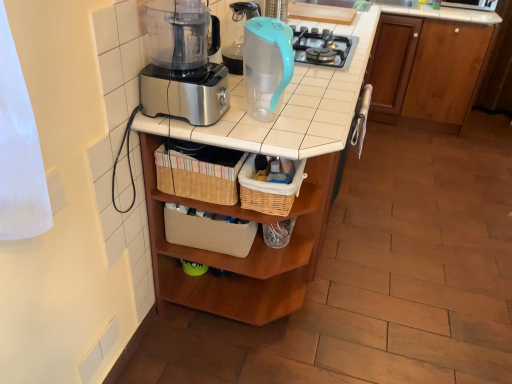
Locate an element on the screen. This screenshot has height=384, width=512. woven wicker basket at center, arranged as the first basket when viewed from the right is located at coordinates (269, 190).

In the scene shown: Which is in front, brown wood cabinet at upper right or wooden table at center?

wooden table at center is more forward.

How many degrees apart are the facing directions of brown wood cabinet at upper right and wooden table at center?

There is a 91-degree angle between the facing directions of brown wood cabinet at upper right and wooden table at center.

Between brown wood cabinet at upper right and wooden table at center, which one appears on the right side from the viewer's perspective?

brown wood cabinet at upper right.

How much distance is there between brown wood cabinet at upper right and woven straw basket at center, arranged as the second basket when viewed from the right?

brown wood cabinet at upper right and woven straw basket at center, arranged as the second basket when viewed from the right, are 2.28 meters apart from each other.

From the image's perspective, which object appears higher, brown wood cabinet at upper right or woven straw basket at center, arranged as the second basket when viewed from the right?

brown wood cabinet at upper right is shown above in the image.

Image resolution: width=512 pixels, height=384 pixels. I want to click on the 1st basket below the brown wood cabinet at upper right (from the image's perspective), so click(x=199, y=171).

Does brown wood cabinet at upper right touch woven straw basket at center, arranged as the second basket when viewed from the right?

No, brown wood cabinet at upper right is not touching woven straw basket at center, arranged as the second basket when viewed from the right.

Does teal plastic pitcher at upper center have a larger size compared to brown wood cabinet at upper right?

Incorrect, teal plastic pitcher at upper center is not larger than brown wood cabinet at upper right.

From a real-world perspective, is teal plastic pitcher at upper center on brown wood cabinet at upper right?

Yes, from a real-world perspective, teal plastic pitcher at upper center is above brown wood cabinet at upper right.

Can you confirm if teal plastic pitcher at upper center is thinner than brown wood cabinet at upper right?

Yes, teal plastic pitcher at upper center is thinner than brown wood cabinet at upper right.

Which of these two, teal plastic pitcher at upper center or brown wood cabinet at upper right, stands taller?

Standing taller between the two is brown wood cabinet at upper right.

Is point (249, 193) closer or farther from the camera than point (286, 78)?

Point (249, 193) appears to be farther away from the viewer than point (286, 78).

Is woven wicker basket at center, arranged as the first basket when viewed from the right, looking in the opposite direction of teal plastic pitcher at upper center?

No, teal plastic pitcher at upper center is not at the back of woven wicker basket at center, arranged as the first basket when viewed from the right.

Where is `the 2nd basket below when counting from the teal plastic pitcher at upper center (from the image's perspective)`? the 2nd basket below when counting from the teal plastic pitcher at upper center (from the image's perspective) is located at coordinates (269, 190).

How many degrees apart are the facing directions of woven wicker basket at center, which appears as the second basket when viewed from the left, and teal plastic pitcher at upper center?

There is a 0.00133-degree angle between the facing directions of woven wicker basket at center, which appears as the second basket when viewed from the left, and teal plastic pitcher at upper center.

What's the angular difference between brown wood cabinet at upper right and woven wicker basket at center, which appears as the second basket when viewed from the left,'s facing directions?

The angular difference between brown wood cabinet at upper right and woven wicker basket at center, which appears as the second basket when viewed from the left, is 91 degrees.

Does brown wood cabinet at upper right have a greater height compared to woven wicker basket at center, which appears as the second basket when viewed from the left?

Yes.

Where is `the 2nd basket in front of the brown wood cabinet at upper right`? The image size is (512, 384). the 2nd basket in front of the brown wood cabinet at upper right is located at coordinates (269, 190).

Considering the relative sizes of woven wicker basket at center, which appears as the second basket when viewed from the left, and woven straw basket at center, arranged as the second basket when viewed from the right, in the image provided, is woven wicker basket at center, which appears as the second basket when viewed from the left, thinner than woven straw basket at center, arranged as the second basket when viewed from the right,?

Correct, the width of woven wicker basket at center, which appears as the second basket when viewed from the left, is less than that of woven straw basket at center, arranged as the second basket when viewed from the right.

From a real-world perspective, is woven wicker basket at center, arranged as the first basket when viewed from the right, above or below woven straw basket at center, arranged as the second basket when viewed from the right?

Clearly, from a real-world perspective, woven wicker basket at center, arranged as the first basket when viewed from the right, is below woven straw basket at center, arranged as the second basket when viewed from the right.

Consider the image. How different are the orientations of woven wicker basket at center, arranged as the first basket when viewed from the right, and woven straw basket at center, arranged as the second basket when viewed from the right, in degrees?

woven wicker basket at center, arranged as the first basket when viewed from the right, and woven straw basket at center, arranged as the second basket when viewed from the right, are facing 0.00157 degrees away from each other.

Considering the relative sizes of woven wicker basket at center, arranged as the first basket when viewed from the right, and woven straw basket at center, the first basket from the left, in the image provided, is woven wicker basket at center, arranged as the first basket when viewed from the right, shorter than woven straw basket at center, the first basket from the left,?

In fact, woven wicker basket at center, arranged as the first basket when viewed from the right, may be taller than woven straw basket at center, the first basket from the left.

Considering the sizes of objects woven straw basket at center, the first basket from the left, and woven wicker basket at center, arranged as the first basket when viewed from the right, in the image provided, who is thinner, woven straw basket at center, the first basket from the left, or woven wicker basket at center, arranged as the first basket when viewed from the right,?

woven wicker basket at center, arranged as the first basket when viewed from the right, is thinner.

From a real-world perspective, is woven straw basket at center, arranged as the second basket when viewed from the right, above or below woven wicker basket at center, which appears as the second basket when viewed from the left?

In terms of real-world spatial position, woven straw basket at center, arranged as the second basket when viewed from the right, is above woven wicker basket at center, which appears as the second basket when viewed from the left.

In the scene shown: Can you tell me how much woven straw basket at center, arranged as the second basket when viewed from the right, and woven wicker basket at center, arranged as the first basket when viewed from the right, differ in facing direction?

They differ by 0.00157 degrees in their facing directions.

This screenshot has width=512, height=384. In order to click on table below the brown wood cabinet at upper right (from the image's perspective) in this screenshot , I will do `click(258, 212)`.

Locate an element on the screen. cabinetry below the woven straw basket at center, the first basket from the left (from a real-world perspective) is located at coordinates click(426, 70).

Considering their positions, is woven straw basket at center, arranged as the second basket when viewed from the right, positioned closer to brown wood cabinet at upper right than teal plastic pitcher at upper center?

teal plastic pitcher at upper center is positioned closer to the anchor brown wood cabinet at upper right.

Considering their positions, is woven straw basket at center, arranged as the second basket when viewed from the right, positioned further to woven wicker basket at center, which appears as the second basket when viewed from the left, than brown wood cabinet at upper right?

brown wood cabinet at upper right lies further to woven wicker basket at center, which appears as the second basket when viewed from the left, than the other object.

Which object lies further to the anchor point woven wicker basket at center, arranged as the first basket when viewed from the right, wooden table at center or brown wood cabinet at upper right?

Based on the image, brown wood cabinet at upper right appears to be further to woven wicker basket at center, arranged as the first basket when viewed from the right.

Considering their positions, is woven wicker basket at center, arranged as the first basket when viewed from the right, positioned further to teal plastic pitcher at upper center than woven straw basket at center, the first basket from the left?

woven straw basket at center, the first basket from the left, is positioned further to the anchor teal plastic pitcher at upper center.

Considering their positions, is teal plastic pitcher at upper center positioned closer to brown wood cabinet at upper right than woven straw basket at center, arranged as the second basket when viewed from the right?

Based on the image, teal plastic pitcher at upper center appears to be nearer to brown wood cabinet at upper right.

From the picture: Estimate the real-world distances between objects in this image. Which object is further from wooden table at center, brown wood cabinet at upper right or woven wicker basket at center, arranged as the first basket when viewed from the right?

brown wood cabinet at upper right.

Looking at the image, which one is located further to wooden table at center, teal plastic pitcher at upper center or woven wicker basket at center, which appears as the second basket when viewed from the left?

teal plastic pitcher at upper center lies further to wooden table at center than the other object.

From the image, which object appears to be farther from woven straw basket at center, arranged as the second basket when viewed from the right, wooden table at center or woven wicker basket at center, which appears as the second basket when viewed from the left?

The object further to woven straw basket at center, arranged as the second basket when viewed from the right, is wooden table at center.

The width and height of the screenshot is (512, 384). Identify the location of kitchen appliance between wooden table at center and woven wicker basket at center, arranged as the first basket when viewed from the right, vertically. (266, 65).

I want to click on basket that lies between teal plastic pitcher at upper center and woven wicker basket at center, which appears as the second basket when viewed from the left, from top to bottom, so click(199, 171).

Locate an element on the screen. table between teal plastic pitcher at upper center and brown wood cabinet at upper right in the front-back direction is located at coordinates (258, 212).

The width and height of the screenshot is (512, 384). I want to click on kitchen appliance between woven straw basket at center, the first basket from the left, and wooden table at center, in the horizontal direction, so click(x=266, y=65).